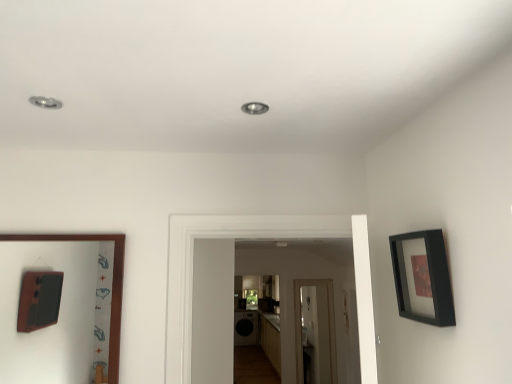
Question: Can you confirm if wooden picture frame at left, which is the 1th picture frame from back to front, is bigger than black matte picture frame at upper right, which is the first picture frame from right to left?

Choices:
 (A) yes
 (B) no

Answer: (A)

Question: Is wooden picture frame at left, the second picture frame positioned from the front, turned away from black matte picture frame at upper right, which is the 2th picture frame in back-to-front order?

Choices:
 (A) no
 (B) yes

Answer: (A)

Question: Can you confirm if wooden picture frame at left, which is the 1th picture frame from back to front, is wider than black matte picture frame at upper right, which appears as the second picture frame when viewed from the left?

Choices:
 (A) yes
 (B) no

Answer: (B)

Question: Is wooden picture frame at left, the second picture frame positioned from the front, beside black matte picture frame at upper right, arranged as the 1th picture frame when viewed from the front?

Choices:
 (A) no
 (B) yes

Answer: (A)

Question: Does wooden picture frame at left, the second picture frame positioned from the front, turn towards black matte picture frame at upper right, which appears as the second picture frame when viewed from the left?

Choices:
 (A) no
 (B) yes

Answer: (A)

Question: Does wooden picture frame at left, the second picture frame positioned from the front, have a greater height compared to black matte picture frame at upper right, which appears as the second picture frame when viewed from the left?

Choices:
 (A) no
 (B) yes

Answer: (B)

Question: Is black matte picture frame at upper right, arranged as the 1th picture frame when viewed from the front, taller than wooden picture frame at left, which is the 1th picture frame from back to front?

Choices:
 (A) no
 (B) yes

Answer: (A)

Question: Is black matte picture frame at upper right, which is the 2th picture frame in back-to-front order, bigger than wooden picture frame at left, the second picture frame positioned from the front?

Choices:
 (A) no
 (B) yes

Answer: (A)

Question: From the image's perspective, is black matte picture frame at upper right, which is the 2th picture frame in back-to-front order, on top of wooden picture frame at left, which is the first picture frame in left-to-right order?

Choices:
 (A) yes
 (B) no

Answer: (A)

Question: From a real-world perspective, is black matte picture frame at upper right, arranged as the 1th picture frame when viewed from the front, beneath wooden picture frame at left, which is counted as the 2th picture frame, starting from the right?

Choices:
 (A) no
 (B) yes

Answer: (A)

Question: Is black matte picture frame at upper right, which is the 2th picture frame in back-to-front order, far from wooden picture frame at left, which is counted as the 2th picture frame, starting from the right?

Choices:
 (A) yes
 (B) no

Answer: (A)

Question: Is black matte picture frame at upper right, which is the 2th picture frame in back-to-front order, at the right side of wooden picture frame at left, which is the first picture frame in left-to-right order?

Choices:
 (A) yes
 (B) no

Answer: (A)

Question: From a real-world perspective, is wooden picture frame at left, which is the first picture frame in left-to-right order, positioned above or below black matte picture frame at upper right, which appears as the second picture frame when viewed from the left?

Choices:
 (A) below
 (B) above

Answer: (A)